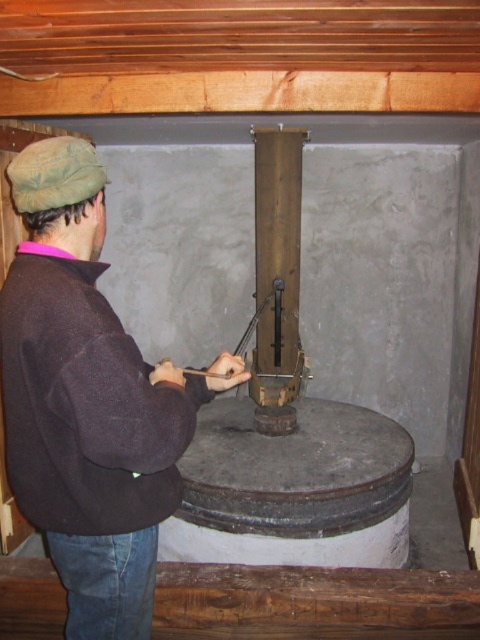
Question: Is brown fleece jacket at left bigger than rusty metal pole at center?

Choices:
 (A) yes
 (B) no

Answer: (A)

Question: Can you confirm if brown fleece jacket at left is positioned above rusty metal pole at center?

Choices:
 (A) yes
 (B) no

Answer: (B)

Question: Among these points, which one is nearest to the camera?

Choices:
 (A) (62, 490)
 (B) (265, 150)

Answer: (A)

Question: Which object is closer to the camera taking this photo?

Choices:
 (A) rusty metal pole at center
 (B) brown fleece jacket at left

Answer: (B)

Question: Can you confirm if brown fleece jacket at left is smaller than rusty metal pole at center?

Choices:
 (A) yes
 (B) no

Answer: (B)

Question: Which point is closer to the camera?

Choices:
 (A) (273, 324)
 (B) (34, 518)

Answer: (B)